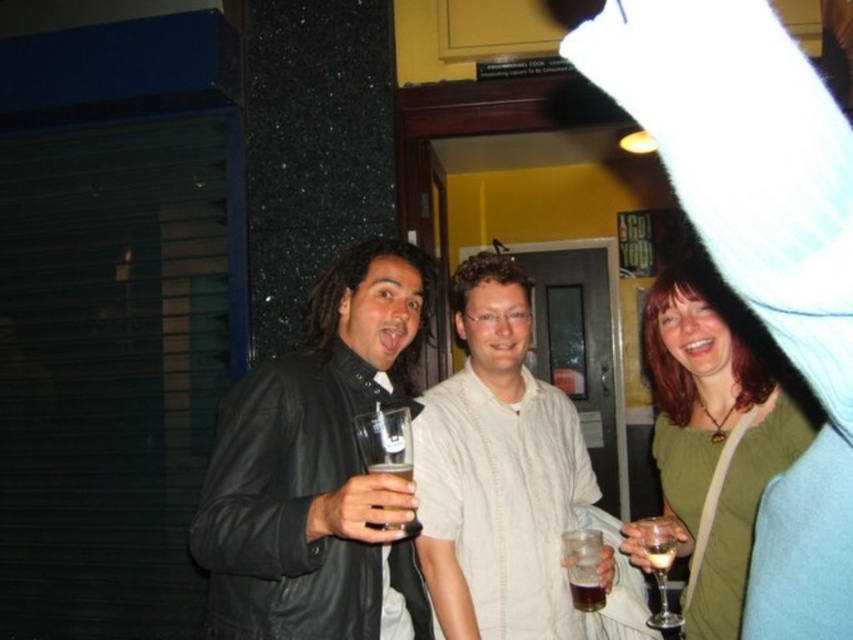
In the scene shown: Is clear glass wine glass at center positioned before dark amber liquid at center?

Yes, clear glass wine glass at center is in front of dark amber liquid at center.

In the scene shown: Does clear glass wine glass at center have a lesser width compared to dark amber liquid at center?

No.

The image size is (853, 640). I want to click on clear glass wine glass at center, so click(x=659, y=564).

Find the location of a particular element. This screenshot has width=853, height=640. clear glass wine glass at center is located at coordinates (659, 564).

Does white textured shirt at center appear over clear glass wine glass at center?

Yes.

Can you confirm if white textured shirt at center is smaller than clear glass wine glass at center?

No, white textured shirt at center is not smaller than clear glass wine glass at center.

Who is more forward, (486,275) or (651,540)?

Point (651,540)

Find the location of `white textured shirt at center`. white textured shirt at center is located at coordinates (497, 472).

I want to click on black leather jacket at left, so click(x=317, y=468).

Consider the image. Does black leather jacket at left have a lesser height compared to clear plastic cup at center?

No, black leather jacket at left is not shorter than clear plastic cup at center.

Where is `black leather jacket at left`? black leather jacket at left is located at coordinates (317, 468).